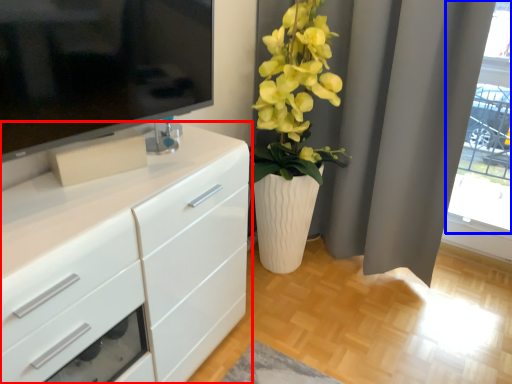
Question: Which point is closer to the camera, chest of drawers (highlighted by a red box) or glass door (highlighted by a blue box)?

Choices:
 (A) chest of drawers
 (B) glass door

Answer: (A)